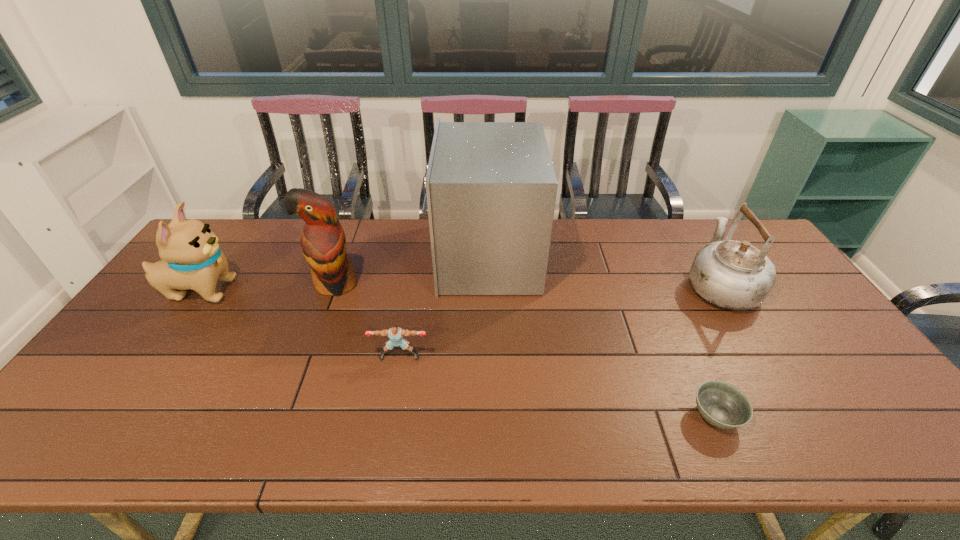
You are a GUI agent. You are given a task and a screenshot of the screen. Output one action in this format:
    pyautogui.click(x=<x>, y=<y>)
    Task: Click on the object that is at the near edge
    This screenshot has width=960, height=540.
    Given the screenshot: What is the action you would take?
    pyautogui.click(x=723, y=405)

This screenshot has width=960, height=540. I want to click on object situated at the left edge, so click(191, 257).

This screenshot has height=540, width=960. Identify the location of object present at the right edge. (733, 275).

This screenshot has height=540, width=960. Identify the location of object that is at the far right corner. (x=733, y=275).

In the image, there is a desktop. Find the location of `vacant space at the far edge`. vacant space at the far edge is located at coordinates (674, 224).

The width and height of the screenshot is (960, 540). I want to click on free location at the left edge, so click(114, 354).

Find the location of `free space at the right edge`. free space at the right edge is located at coordinates (782, 325).

The width and height of the screenshot is (960, 540). Find the location of `vacant space that's between the second nearest object and the bowl`. vacant space that's between the second nearest object and the bowl is located at coordinates click(558, 386).

This screenshot has height=540, width=960. I want to click on vacant area that lies between the parrot and the toaster oven, so click(410, 271).

The image size is (960, 540). What are the coordinates of `blank region between the fifth tallest object and the shortest object` in the screenshot? It's located at (558, 386).